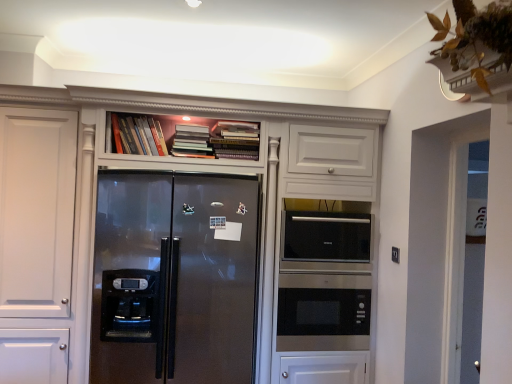
What do you see at coordinates (326, 237) in the screenshot?
I see `sleek stainless steel microwave at center` at bounding box center [326, 237].

This screenshot has width=512, height=384. What do you see at coordinates (323, 314) in the screenshot?
I see `stainless steel microwave at center` at bounding box center [323, 314].

The height and width of the screenshot is (384, 512). Describe the element at coordinates (234, 140) in the screenshot. I see `hardcover books at upper center, the first book viewed from the right` at that location.

What is the approximate height of hardcover books at upper center, the first book viewed from the left?

The height of hardcover books at upper center, the first book viewed from the left, is 8.94 inches.

What do you see at coordinates (136, 135) in the screenshot?
I see `hardcover books at upper center, the first book viewed from the left` at bounding box center [136, 135].

Find the location of a particular element. This screenshot has width=512, height=384. hardcover books at upper center, which is the 2th book in right-to-left order is located at coordinates (191, 141).

In order to click on sleek stainless steel microwave at center in this screenshot , I will do `click(326, 237)`.

Is satin black refrigerator at center outside of hardcover books at upper center, the third book positioned from the left?

Indeed, satin black refrigerator at center is completely outside hardcover books at upper center, the third book positioned from the left.

Could you tell me if satin black refrigerator at center is turned towards hardcover books at upper center, the third book positioned from the left?

No, satin black refrigerator at center is not oriented towards hardcover books at upper center, the third book positioned from the left.

From the image's perspective, which one is positioned higher, satin black refrigerator at center or hardcover books at upper center, the first book viewed from the right?

hardcover books at upper center, the first book viewed from the right.

Is satin black refrigerator at center to the right of hardcover books at upper center, the first book viewed from the right, from the viewer's perspective?

In fact, satin black refrigerator at center is to the left of hardcover books at upper center, the first book viewed from the right.

Is stainless steel microwave at center at the back of hardcover books at upper center, the first book viewed from the right?

hardcover books at upper center, the first book viewed from the right, is not turned away from stainless steel microwave at center.

From a real-world perspective, is hardcover books at upper center, the first book viewed from the right, physically above stainless steel microwave at center?

Yes, from a real-world perspective, hardcover books at upper center, the first book viewed from the right, is over stainless steel microwave at center

Considering the sizes of objects hardcover books at upper center, the third book positioned from the left, and stainless steel microwave at center in the image provided, who is taller, hardcover books at upper center, the third book positioned from the left, or stainless steel microwave at center?

With more height is stainless steel microwave at center.

Which object is positioned more to the right, sleek stainless steel microwave at center or satin white cabinet at upper center?

sleek stainless steel microwave at center.

Which is in front, sleek stainless steel microwave at center or satin white cabinet at upper center?

satin white cabinet at upper center is closer to the camera.

Can you see sleek stainless steel microwave at center touching satin white cabinet at upper center?

No.

From a real-world perspective, is sleek stainless steel microwave at center positioned above or below satin white cabinet at upper center?

From a real-world perspective, sleek stainless steel microwave at center is physically above satin white cabinet at upper center.

From the picture: Considering the sizes of sleek stainless steel microwave at center and hardcover books at upper center, marked as the 3th book in a right-to-left arrangement, in the image, is sleek stainless steel microwave at center wider or thinner than hardcover books at upper center, marked as the 3th book in a right-to-left arrangement,?

Considering their sizes, sleek stainless steel microwave at center looks broader than hardcover books at upper center, marked as the 3th book in a right-to-left arrangement.

Considering the relative positions of sleek stainless steel microwave at center and hardcover books at upper center, marked as the 3th book in a right-to-left arrangement, in the image provided, is sleek stainless steel microwave at center behind hardcover books at upper center, marked as the 3th book in a right-to-left arrangement,?

Yes, it is behind hardcover books at upper center, marked as the 3th book in a right-to-left arrangement.

From the picture: Is sleek stainless steel microwave at center located outside hardcover books at upper center, marked as the 3th book in a right-to-left arrangement?

sleek stainless steel microwave at center is positioned outside hardcover books at upper center, marked as the 3th book in a right-to-left arrangement.

From the image's perspective, is sleek stainless steel microwave at center on top of hardcover books at upper center, marked as the 3th book in a right-to-left arrangement?

No, from the image's perspective, sleek stainless steel microwave at center is not on top of hardcover books at upper center, marked as the 3th book in a right-to-left arrangement.

How much distance is there between satin white cabinet at upper center and sleek stainless steel microwave at center?

satin white cabinet at upper center and sleek stainless steel microwave at center are 18.31 inches apart.

How different are the orientations of satin white cabinet at upper center and sleek stainless steel microwave at center in degrees?

satin white cabinet at upper center and sleek stainless steel microwave at center are facing 0.771 degrees away from each other.

Which of these two, satin white cabinet at upper center or sleek stainless steel microwave at center, is smaller?

sleek stainless steel microwave at center is smaller.

This screenshot has height=384, width=512. I want to click on appliance that appears behind the satin white cabinet at upper center, so pyautogui.click(x=326, y=237).

Is satin black refrigerator at center facing towards sleek stainless steel microwave at center?

No, satin black refrigerator at center is not turned towards sleek stainless steel microwave at center.

Between satin black refrigerator at center and sleek stainless steel microwave at center, which one appears on the left side from the viewer's perspective?

From the viewer's perspective, satin black refrigerator at center appears more on the left side.

Is point (242, 242) more distant than point (346, 222)?

That is False.

Is satin black refrigerator at center further to camera compared to sleek stainless steel microwave at center?

No, satin black refrigerator at center is closer to the viewer.

This screenshot has height=384, width=512. In the image, there is a hardcover books at upper center, the first book viewed from the left. What are the coordinates of `refrigerator below it (from a real-world perspective)` in the screenshot? It's located at (174, 277).

Does point (140, 122) come in front of point (152, 240)?

No, (140, 122) is behind (152, 240).

Which object is wider, hardcover books at upper center, the first book viewed from the left, or satin black refrigerator at center?

With larger width is satin black refrigerator at center.

Where is `the 2nd book behind the satin black refrigerator at center`? the 2nd book behind the satin black refrigerator at center is located at coordinates (234, 140).

You are a GUI agent. You are given a task and a screenshot of the screen. Output one action in this format:
    pyautogui.click(x=<x>, y=<y>)
    Task: Click on the microwave oven below the hardcover books at upper center, the first book viewed from the right (from a real-world perspective)
    The image size is (512, 384).
    Given the screenshot: What is the action you would take?
    pyautogui.click(x=323, y=314)

When comparing their distances from satin black refrigerator at center, does satin white cabinet at upper center or hardcover books at upper center, arranged as the second book when viewed from the left, seem further?

Based on the image, hardcover books at upper center, arranged as the second book when viewed from the left, appears to be further to satin black refrigerator at center.

Considering their positions, is hardcover books at upper center, the third book positioned from the left, positioned closer to sleek stainless steel microwave at center than hardcover books at upper center, which is the 2th book in right-to-left order?

hardcover books at upper center, the third book positioned from the left, is closer to sleek stainless steel microwave at center.

Based on the photo, from the image, which object appears to be nearer to sleek stainless steel microwave at center, satin black refrigerator at center or satin white cabinet at upper center?

satin white cabinet at upper center lies closer to sleek stainless steel microwave at center than the other object.

Estimate the real-world distances between objects in this image. Which object is closer to hardcover books at upper center, marked as the 3th book in a right-to-left arrangement, satin black refrigerator at center or hardcover books at upper center, which is the 2th book in right-to-left order?

hardcover books at upper center, which is the 2th book in right-to-left order, is closer to hardcover books at upper center, marked as the 3th book in a right-to-left arrangement.

Which object lies further to the anchor point hardcover books at upper center, the first book viewed from the right, stainless steel microwave at center or hardcover books at upper center, which is the 2th book in right-to-left order?

Based on the image, stainless steel microwave at center appears to be further to hardcover books at upper center, the first book viewed from the right.

Considering their positions, is sleek stainless steel microwave at center positioned closer to satin black refrigerator at center than hardcover books at upper center, marked as the 3th book in a right-to-left arrangement?

Based on the image, sleek stainless steel microwave at center appears to be nearer to satin black refrigerator at center.

When comparing their distances from hardcover books at upper center, the third book positioned from the left, does sleek stainless steel microwave at center or hardcover books at upper center, which is the 2th book in right-to-left order, seem closer?

hardcover books at upper center, which is the 2th book in right-to-left order, lies closer to hardcover books at upper center, the third book positioned from the left, than the other object.

Considering their positions, is hardcover books at upper center, which is the 2th book in right-to-left order, positioned closer to hardcover books at upper center, marked as the 3th book in a right-to-left arrangement, than satin black refrigerator at center?

hardcover books at upper center, which is the 2th book in right-to-left order.

Identify the location of book between hardcover books at upper center, the first book viewed from the right, and stainless steel microwave at center, in the vertical direction. The width and height of the screenshot is (512, 384). (191, 141).

This screenshot has height=384, width=512. In order to click on microwave oven between hardcover books at upper center, the first book viewed from the left, and sleek stainless steel microwave at center from left to right in this screenshot , I will do `click(323, 314)`.

Locate an element on the screen. Image resolution: width=512 pixels, height=384 pixels. cupboard between hardcover books at upper center, arranged as the second book when viewed from the left, and stainless steel microwave at center from top to bottom is located at coordinates (185, 246).

Identify the location of microwave oven situated between satin white cabinet at upper center and sleek stainless steel microwave at center from left to right. (323, 314).